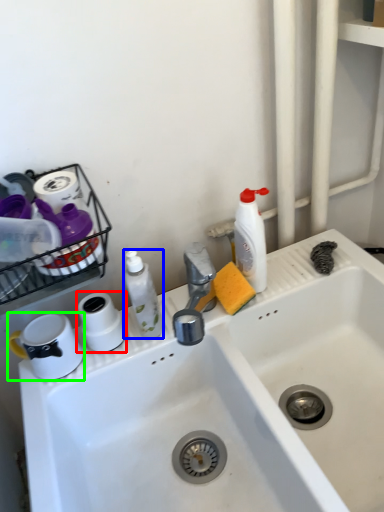
Question: Which is nearer to the toilet paper (highlighted by a red box)? cleaning product (highlighted by a blue box) or appliance (highlighted by a green box).

Choices:
 (A) cleaning product
 (B) appliance

Answer: (B)